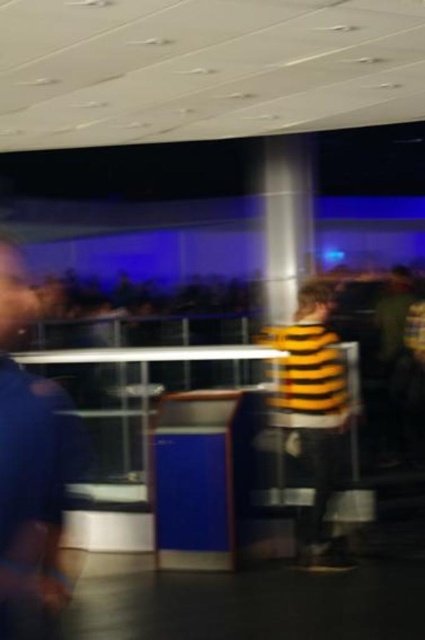
Question: Which of the following is the farthest from the observer?

Choices:
 (A) (340, 426)
 (B) (11, 445)

Answer: (A)

Question: Is the position of blue fabric shirt at left more distant than that of yellow striped shirt at center?

Choices:
 (A) yes
 (B) no

Answer: (B)

Question: Among these objects, which one is farthest from the camera?

Choices:
 (A) yellow striped shirt at center
 (B) blue fabric shirt at left

Answer: (A)

Question: Which of the following is the farthest from the observer?

Choices:
 (A) blue fabric shirt at left
 (B) yellow striped shirt at center

Answer: (B)

Question: Does blue fabric shirt at left have a greater width compared to yellow striped shirt at center?

Choices:
 (A) yes
 (B) no

Answer: (B)

Question: Does blue fabric shirt at left appear under yellow striped shirt at center?

Choices:
 (A) yes
 (B) no

Answer: (B)